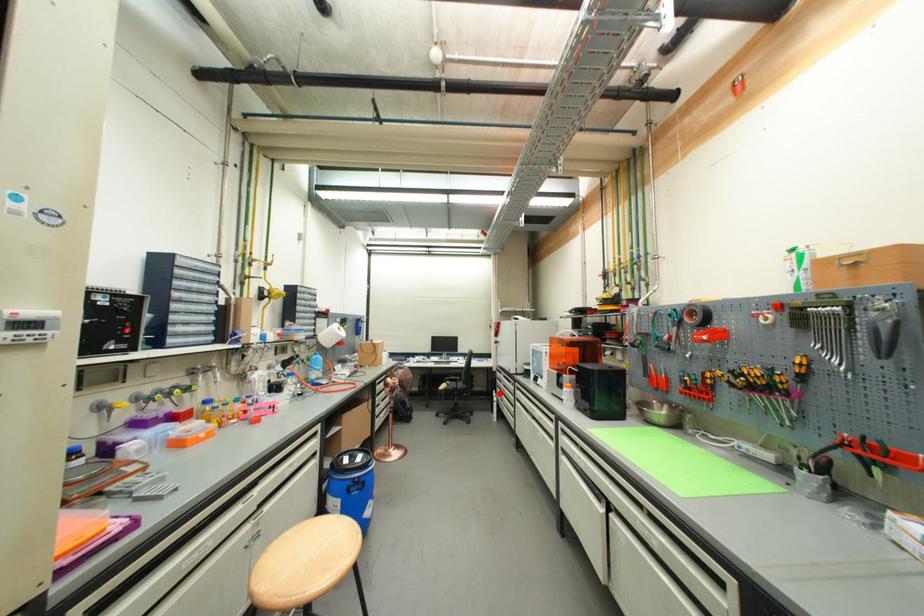
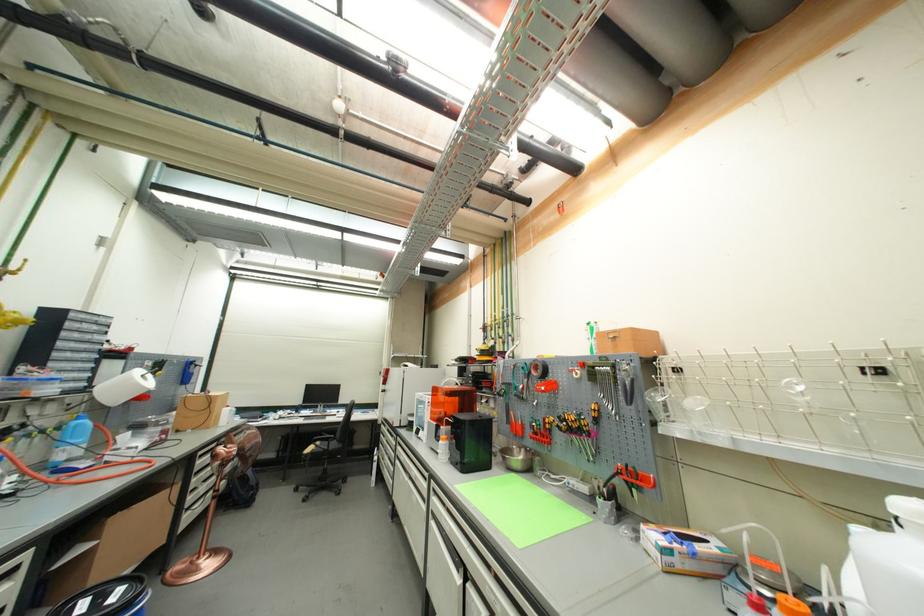
Question: A red point is marked in image1. In image2, is the corresponding 3D point closer to the camera or farther? Reply with the corresponding letter.

Choices:
 (A) The corresponding 3D point is closer.
 (B) The corresponding 3D point is farther.

Answer: (B)